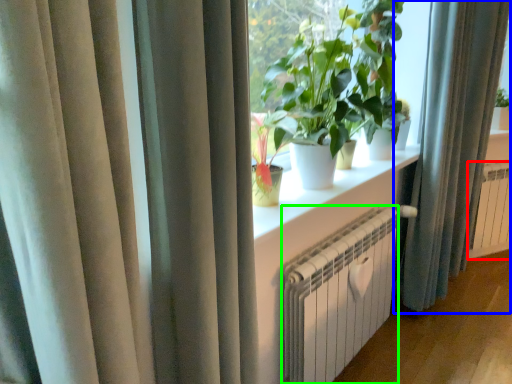
Question: Estimate the real-world distances between objects in this image. Which object is closer to radiator (highlighted by a red box), curtain (highlighted by a blue box) or heater (highlighted by a green box)?

Choices:
 (A) curtain
 (B) heater

Answer: (A)